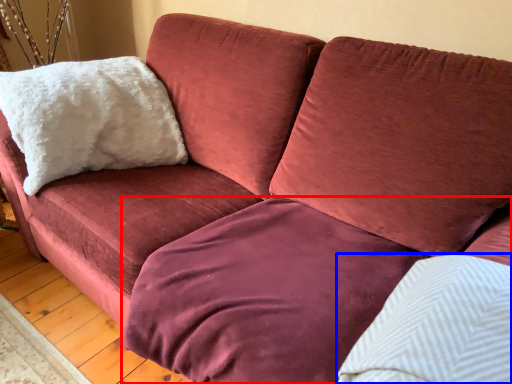
Question: Among these objects, which one is nearest to the camera, bedding (highlighted by a red box) or pillow (highlighted by a blue box)?

Choices:
 (A) bedding
 (B) pillow

Answer: (B)